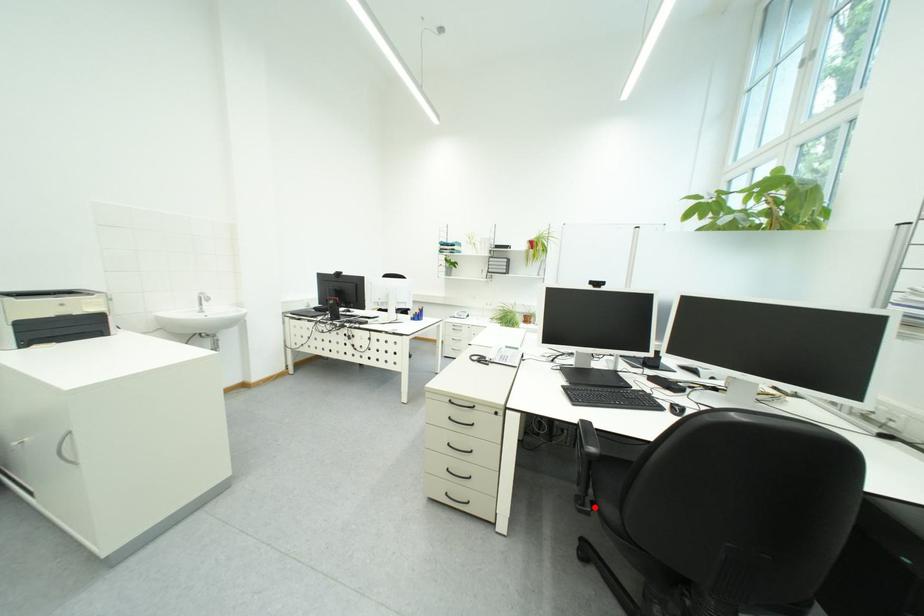
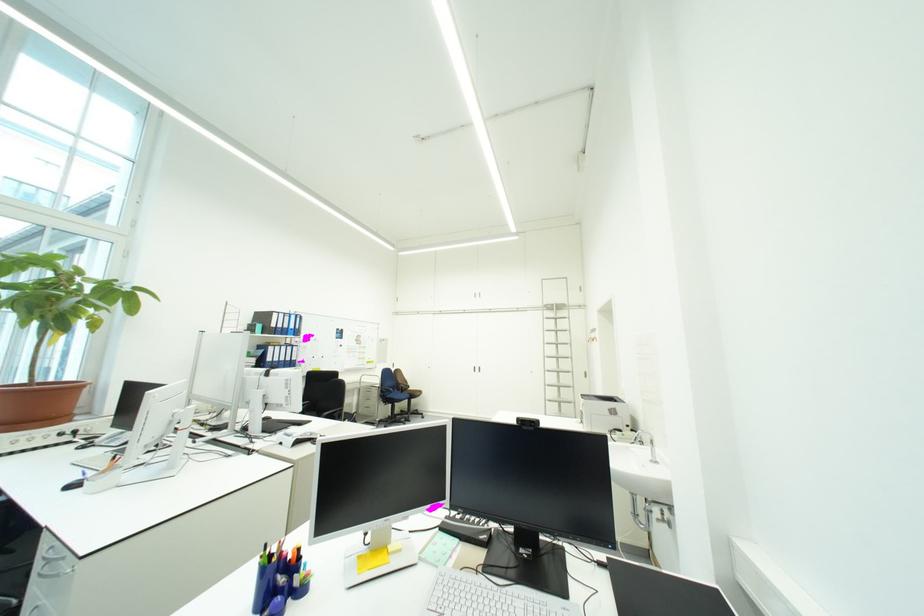
Question: I am providing you with two images of the same scene from different viewpoints. A red point is marked on the first image. At the location where the point appears in image 1, is it still visible in image 2?

Choices:
 (A) Yes
 (B) No

Answer: (B)